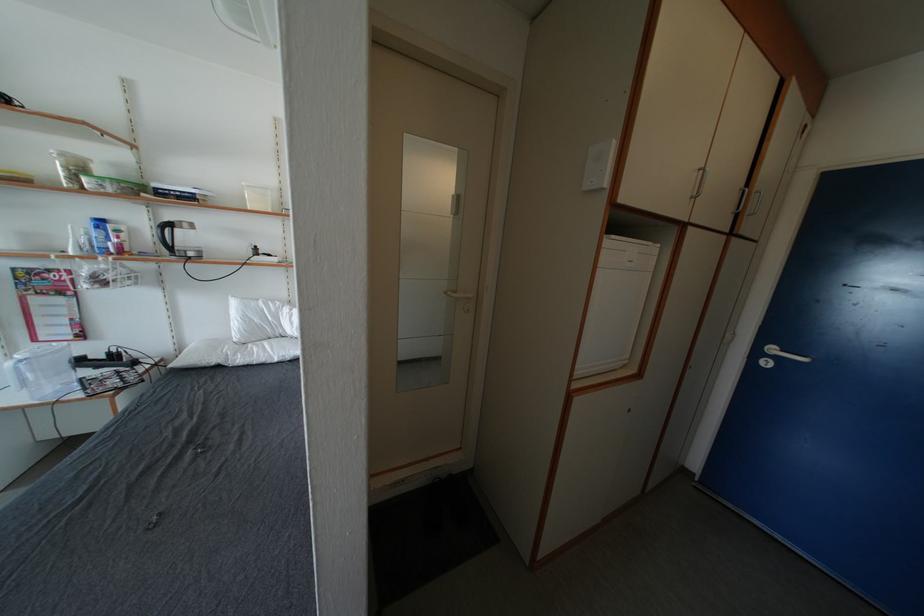
Identify the location of black kettle handle. Image resolution: width=924 pixels, height=616 pixels. (176, 238).